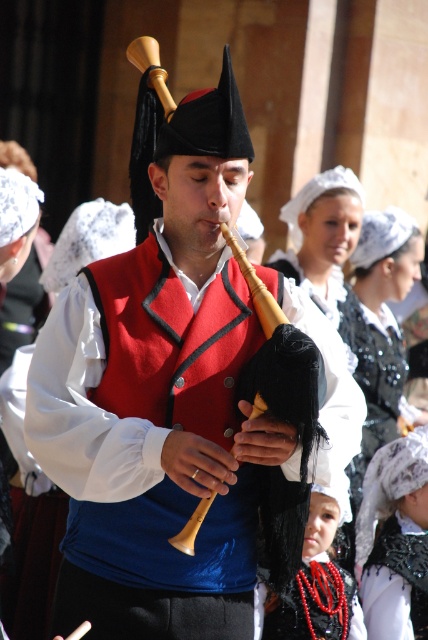
Which is above, matte red vest at center or black beaded necklace at center?

Positioned higher is matte red vest at center.

Can you confirm if matte red vest at center is taller than black beaded necklace at center?

Correct, matte red vest at center is much taller as black beaded necklace at center.

Is point (195, 156) positioned in front of point (350, 596)?

Yes, point (195, 156) is in front of point (350, 596).

I want to click on matte red vest at center, so (175, 394).

Does black sequined dress at center appear over black beaded necklace at center?

Yes.

Consider the image. Is black sequined dress at center to the left of black beaded necklace at center from the viewer's perspective?

No, black sequined dress at center is not to the left of black beaded necklace at center.

The image size is (428, 640). Find the location of `black sequined dress at center`. black sequined dress at center is located at coordinates (395, 580).

Can you confirm if black beaded necklace at center is taller than wooden bagpipe at center?

No, black beaded necklace at center is not taller than wooden bagpipe at center.

Where is `black beaded necklace at center`? The image size is (428, 640). black beaded necklace at center is located at coordinates (309, 605).